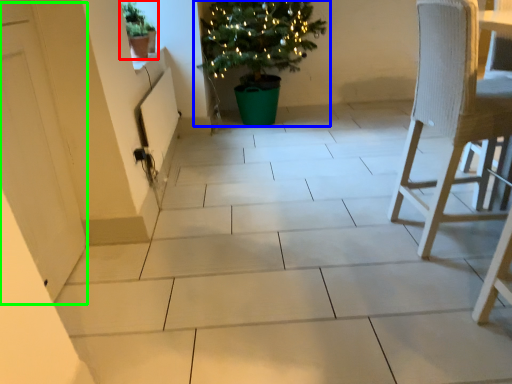
Question: Considering the real-world distances, which object is closest to houseplant (highlighted by a red box)? houseplant (highlighted by a blue box) or screen door (highlighted by a green box).

Choices:
 (A) houseplant
 (B) screen door

Answer: (A)